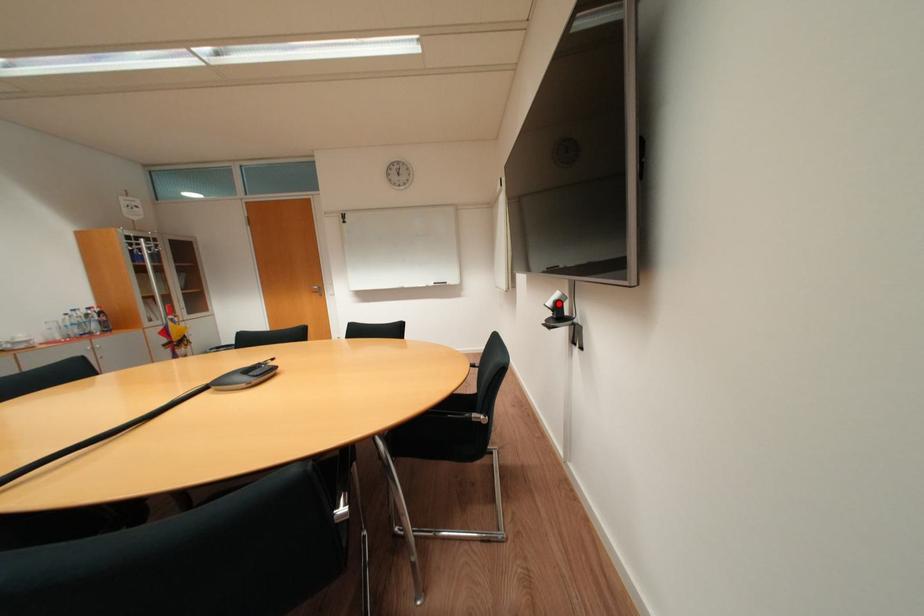
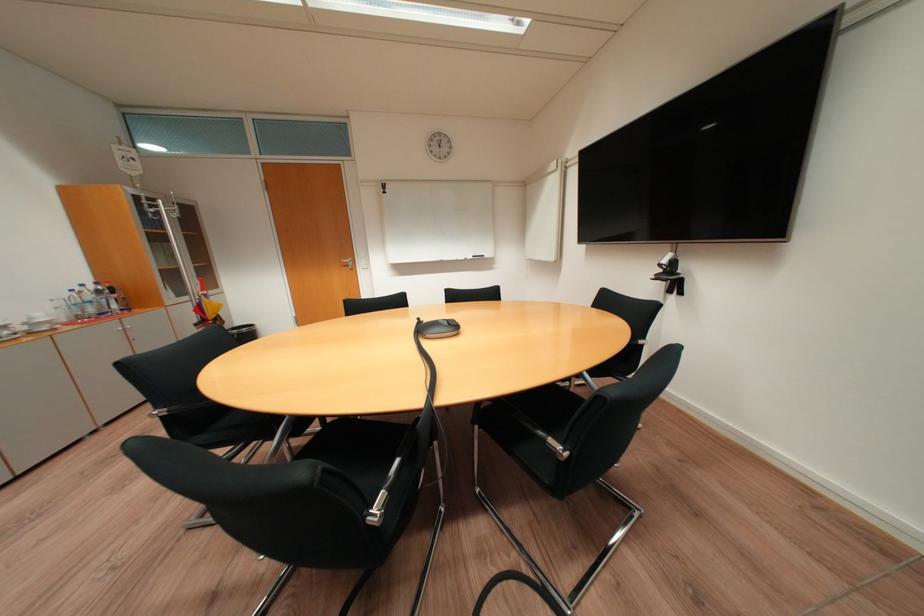
The point at the highlighted location is marked in the first image. Where is the corresponding point in the second image?

(673, 262)